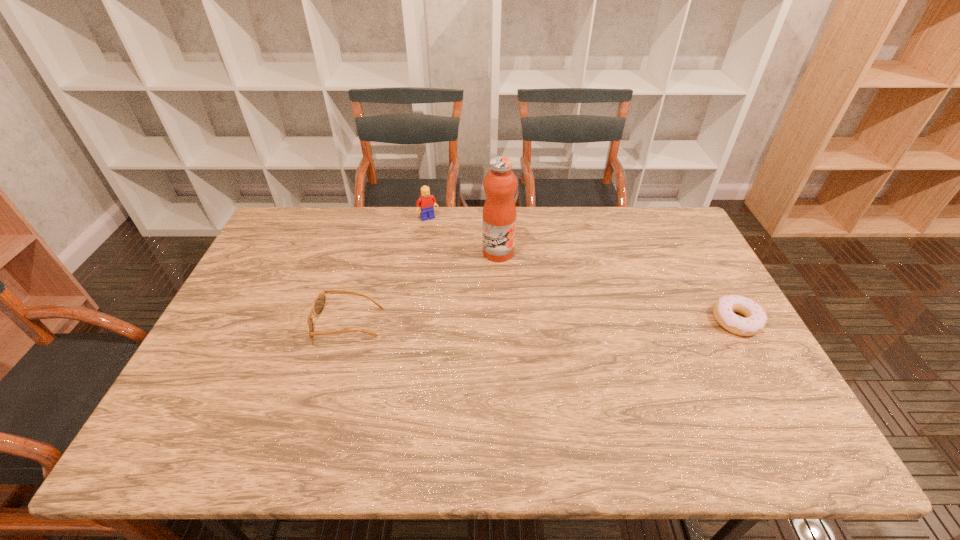
This screenshot has height=540, width=960. What are the coordinates of `blank area in the image that satisfies the following two spatial constraints: 1. on the front side of the fruit juice; 2. on the right side of the third shortest object` in the screenshot? It's located at (422, 252).